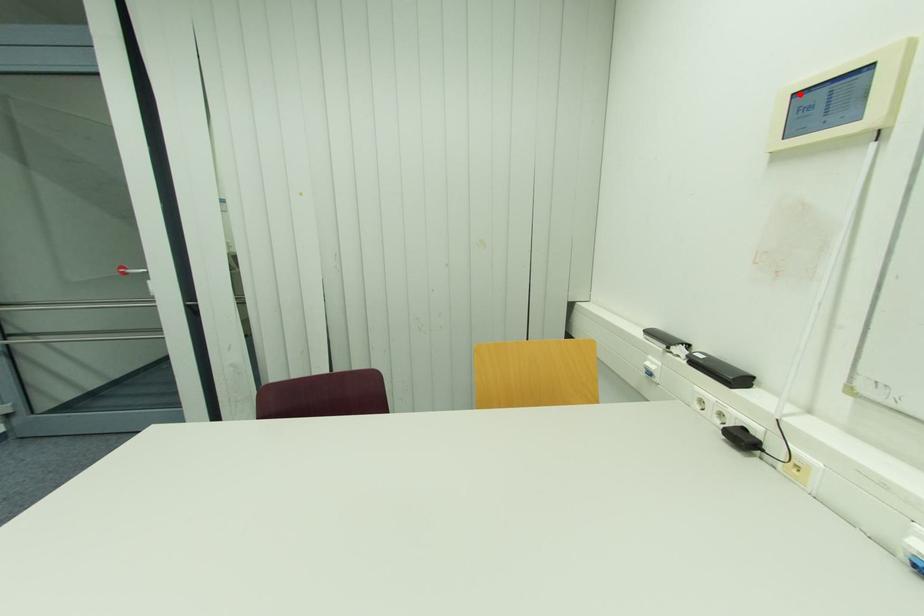
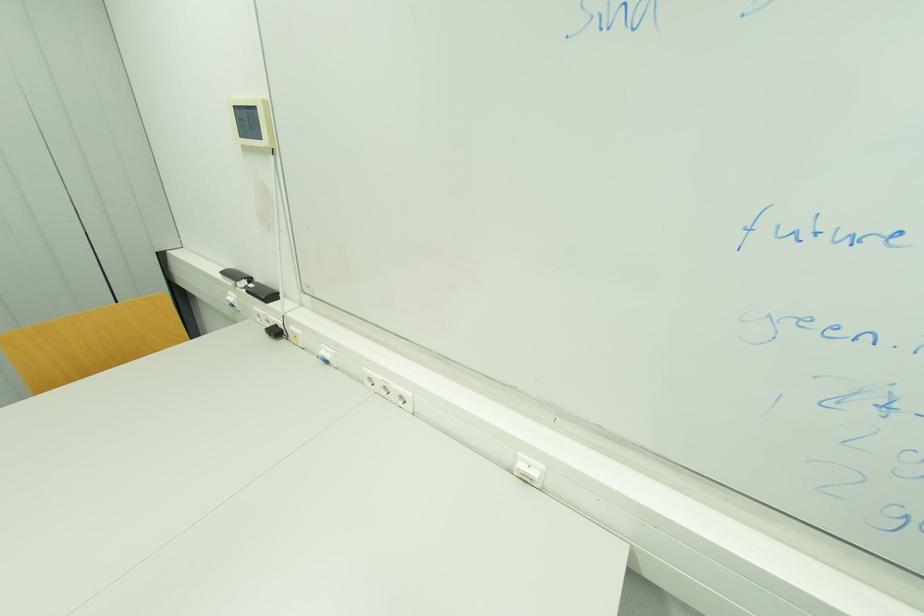
Find the pixel in the second image that matches the highlighted location in the first image.

(237, 108)